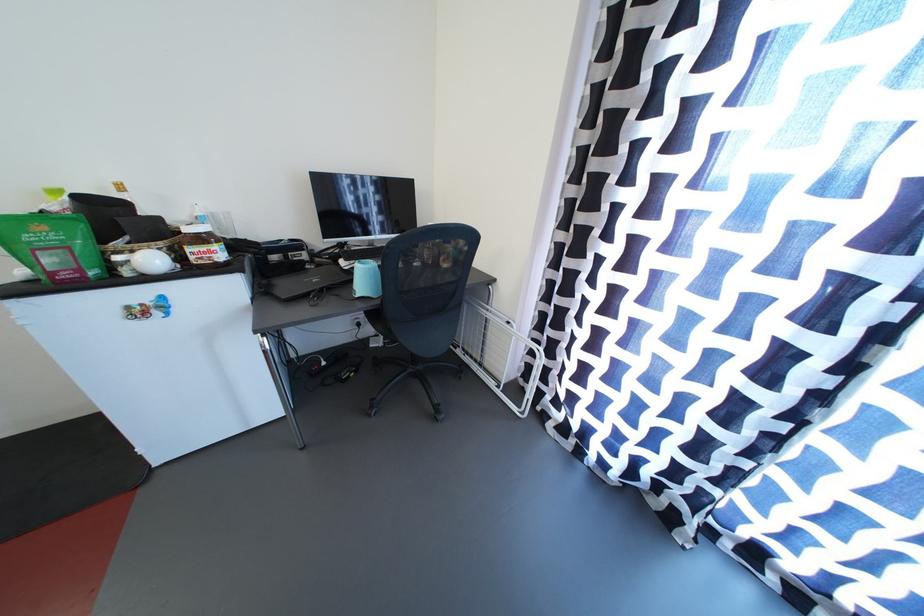
Where would you lift the white egg object? Please return your answer as a coordinate pair (x, y).

(151, 262)